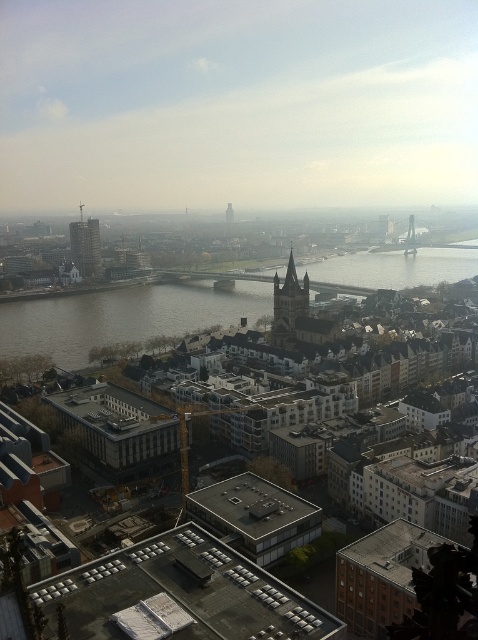
Can you confirm if brown water at center is shorter than dark brown stone tower at center?

Incorrect, brown water at center's height does not fall short of dark brown stone tower at center's.

Does brown water at center appear on the right side of dark brown stone tower at center?

Indeed, brown water at center is positioned on the right side of dark brown stone tower at center.

Is point (26, 342) less distant than point (282, 284)?

That is False.

This screenshot has height=640, width=478. I want to click on brown water at center, so click(x=125, y=316).

What do you see at coordinates (289, 300) in the screenshot? This screenshot has height=640, width=478. I see `dark brown stone tower at center` at bounding box center [289, 300].

Who is taller, dark brown stone tower at center or matte glass skyscraper at center-left?

Standing taller between the two is matte glass skyscraper at center-left.

Which is in front, point (297, 282) or point (80, 269)?

Point (297, 282)

What are the coordinates of `dark brown stone tower at center` in the screenshot? It's located at (289, 300).

Does brown water at center appear over matte glass skyscraper at center-left?

No, brown water at center is not above matte glass skyscraper at center-left.

Does point (332, 275) lie in front of point (95, 220)?

That is False.

Who is more distant from viewer, (217,308) or (97,275)?

The point (97,275) is behind.

Where is `brown water at center`? Image resolution: width=478 pixels, height=640 pixels. brown water at center is located at coordinates (125, 316).